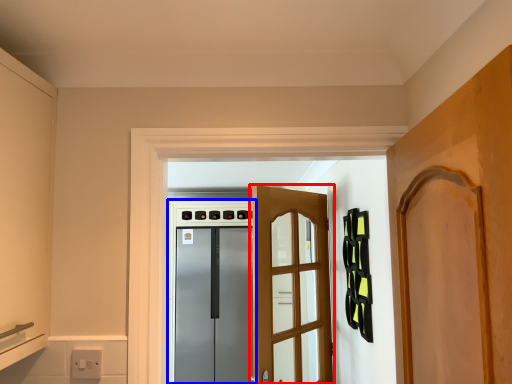
Question: Which object appears closest to the camera in this image, door (highlighted by a red box) or appliance (highlighted by a blue box)?

Choices:
 (A) door
 (B) appliance

Answer: (A)